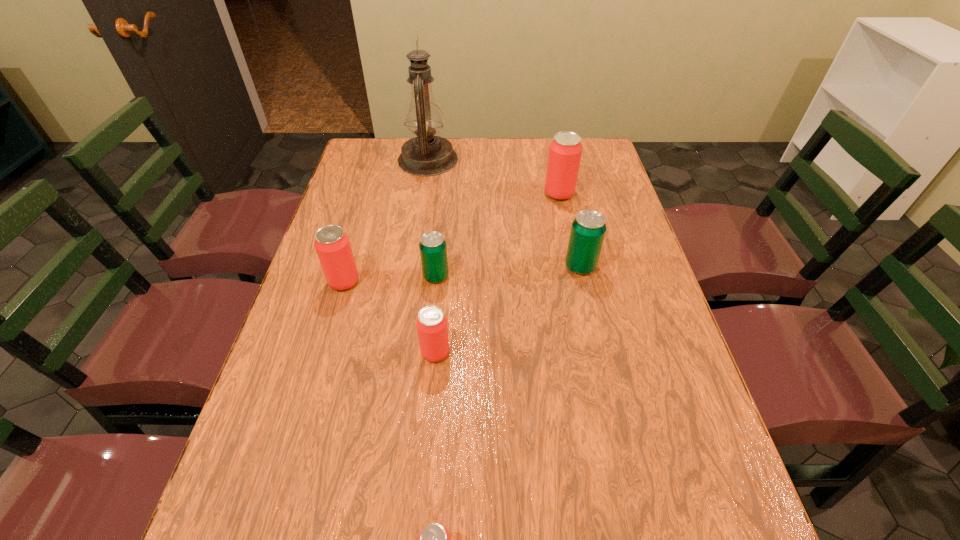
Identify which object is the fifth closest to the right teal beer can. Please provide its 2D coordinates. Your answer should be formatted as a tuple, i.e. [(x, y)], where the tuple contains the x and y coordinates of a point satisfying the conditions above.

[(332, 244)]

Identify the location of the fifth closest beer can to the nearest beer can. This screenshot has height=540, width=960. point(565,151).

You are a GUI agent. You are given a task and a screenshot of the screen. Output one action in this format:
    pyautogui.click(x=<x>, y=<y>)
    Task: Click on the beer can that stands as the third closest to the nearest red beer can
    The image size is (960, 540).
    Given the screenshot: What is the action you would take?
    pyautogui.click(x=332, y=244)

Locate an element on the screen. red beer can identified as the third closest to the bigger teal beer can is located at coordinates (332, 244).

Identify which red beer can is the fourth nearest to the smaller teal beer can. Please provide its 2D coordinates. Your answer should be formatted as a tuple, i.e. [(x, y)], where the tuple contains the x and y coordinates of a point satisfying the conditions above.

[(434, 539)]

At what (x,y) coordinates should I click in order to perform the action: click on teal beer can that is the closest one to the leftmost object. Please return your answer as a coordinate pair (x, y). Image resolution: width=960 pixels, height=540 pixels. Looking at the image, I should click on (433, 250).

Select which teal beer can is the closest to the shortest object. Please provide its 2D coordinates. Your answer should be formatted as a tuple, i.e. [(x, y)], where the tuple contains the x and y coordinates of a point satisfying the conditions above.

[(433, 250)]

Locate an element on the screen. free spot that satisfies the following two spatial constraints: 1. on the back side of the left teal beer can; 2. on the right side of the bigger teal beer can is located at coordinates (437, 266).